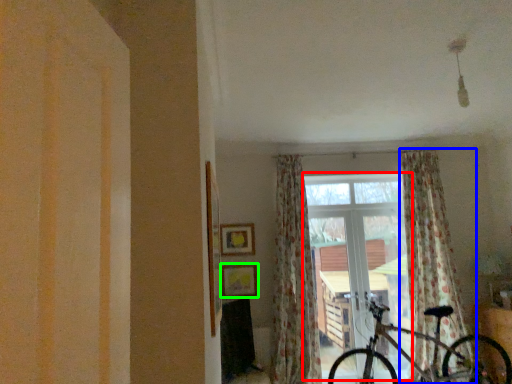
Question: Which object is positioned farthest from window (highlighted by a red box)? Select from curtain (highlighted by a blue box) and picture frame (highlighted by a green box).

Choices:
 (A) curtain
 (B) picture frame

Answer: (B)